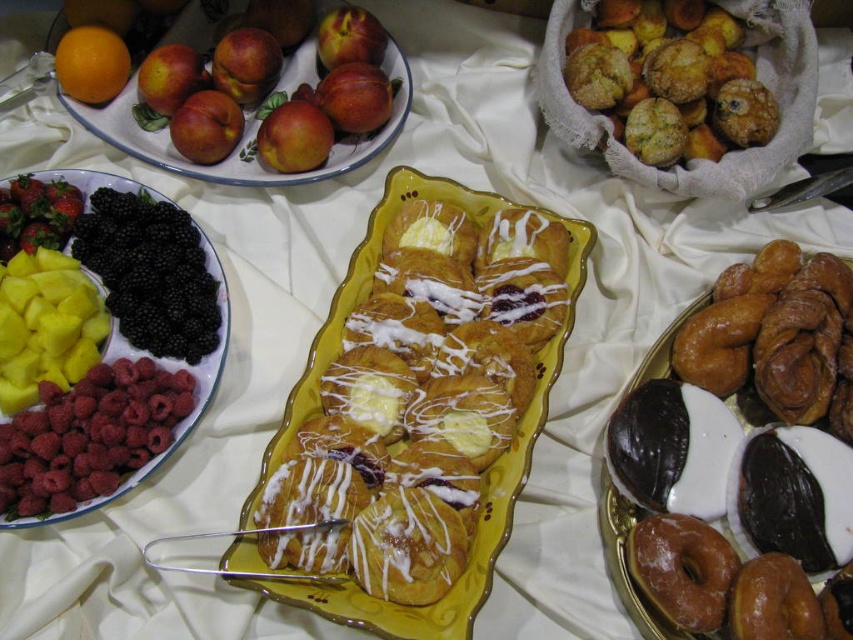
Question: Among these points, which one is farthest from the camera?

Choices:
 (A) (263, 150)
 (B) (453, 248)
 (C) (602, 84)

Answer: (A)

Question: Can you confirm if glazed doughnuts at right is thinner than orange matte at upper left?

Choices:
 (A) no
 (B) yes

Answer: (A)

Question: Does yellow crumbly muffin at upper right have a larger size compared to glazed doughnuts at right?

Choices:
 (A) yes
 (B) no

Answer: (B)

Question: Does shiny red strawberry at left have a greater width compared to red matte apple at center?

Choices:
 (A) no
 (B) yes

Answer: (A)

Question: Which of the following is the closest to the observer?

Choices:
 (A) red matte apple at center
 (B) shiny ceramic plate at upper left

Answer: (A)

Question: Estimate the real-world distances between objects in this image. Which object is farther from the red matte apple at center?

Choices:
 (A) glazed doughnuts at right
 (B) red matte apple at upper left

Answer: (A)